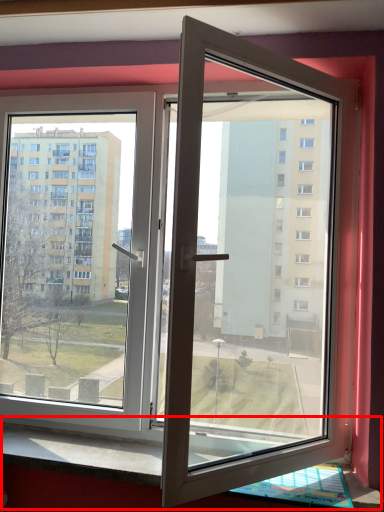
Question: From the image's perspective, what is the correct spatial relationship of window sill (annotated by the red box) in relation to door?

Choices:
 (A) below
 (B) above

Answer: (A)